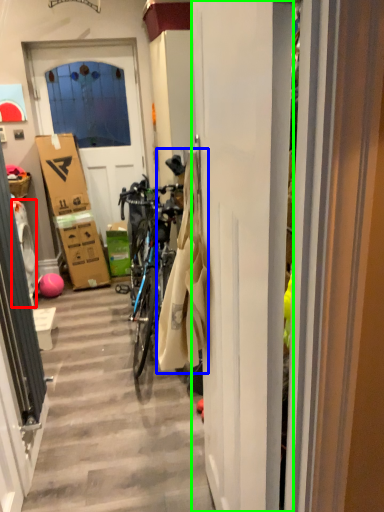
Question: Estimate the real-world distances between objects in this image. Which object is closer to washing machine (highlighted by a red box), laundry (highlighted by a blue box) or door (highlighted by a green box)?

Choices:
 (A) laundry
 (B) door

Answer: (A)